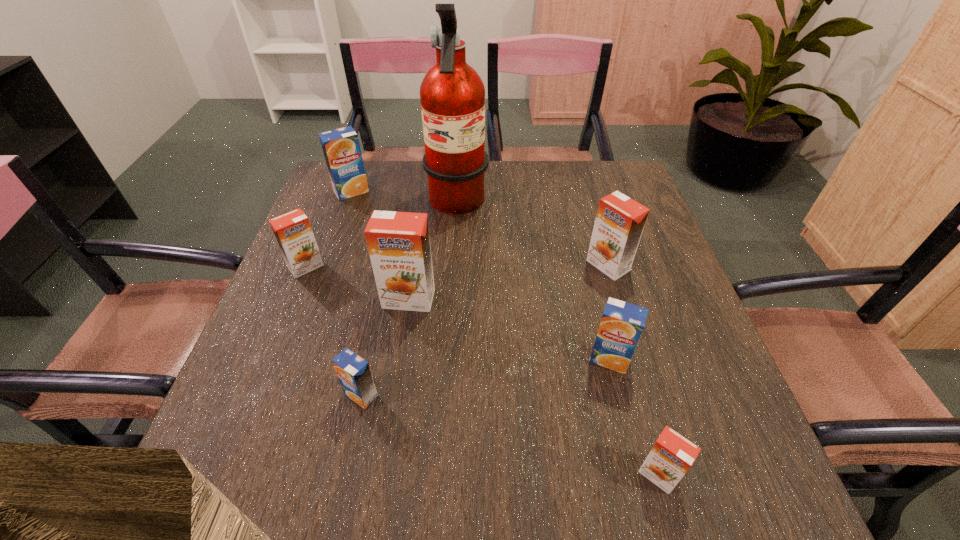
At what (x,y) coordinates should I click in order to perform the action: click on the sixth farthest orange juice. Please return your answer as a coordinate pair (x, y). Looking at the image, I should click on (354, 374).

Locate an element on the screen. the smallest orange orange juice is located at coordinates (671, 457).

The height and width of the screenshot is (540, 960). In order to click on the nearest orange juice in this screenshot , I will do `click(671, 457)`.

This screenshot has height=540, width=960. What are the coordinates of `vacant space located 0.250m on the nozzle and handle of the fire extinguisher` in the screenshot? It's located at (578, 206).

Locate an element on the screen. Image resolution: width=960 pixels, height=540 pixels. vacant area located on the front of the fourth farthest orange juice is located at coordinates (389, 431).

This screenshot has height=540, width=960. I want to click on free space located 0.340m on the right of the farthest orange juice, so click(x=487, y=191).

The width and height of the screenshot is (960, 540). I want to click on vacant region located on the left of the second biggest orange orange juice, so click(492, 266).

Locate an element on the screen. The width and height of the screenshot is (960, 540). vacant space located on the back of the leftmost orange orange juice is located at coordinates (333, 199).

This screenshot has height=540, width=960. Find the location of `free point located on the left of the sixth farthest object`. free point located on the left of the sixth farthest object is located at coordinates (513, 359).

At what (x,y) coordinates should I click in order to perform the action: click on vacant space located 0.110m on the front of the second blue orange_juice from right to left. Please return your answer as a coordinate pair (x, y). The image size is (960, 540). Looking at the image, I should click on (346, 471).